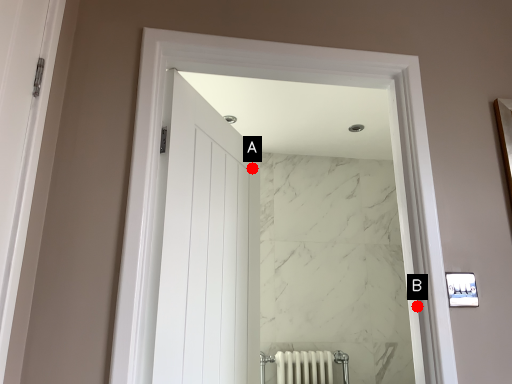
Question: Two points are circled on the image, labeled by A and B beside each circle. Among these points, which one is farthest from the camera?

Choices:
 (A) A is further
 (B) B is further

Answer: (A)